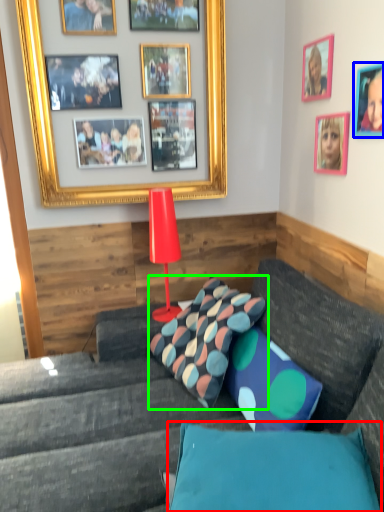
Question: Which is nearer to the pillow (highlighted by a red box)? picture frame (highlighted by a blue box) or pillow (highlighted by a green box).

Choices:
 (A) picture frame
 (B) pillow

Answer: (B)